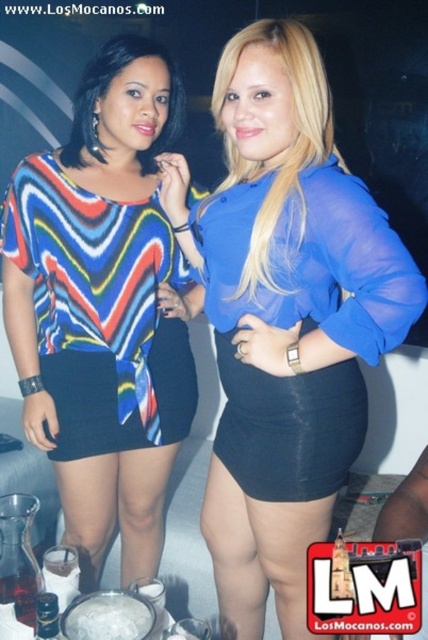
Does blue sheer blouse at center appear under multicolored printed blouse at left?

Yes.

Does blue sheer blouse at center have a lesser height compared to multicolored printed blouse at left?

No, blue sheer blouse at center is not shorter than multicolored printed blouse at left.

Does point (315, 252) come closer to viewer compared to point (146, 337)?

Yes, point (315, 252) is closer to viewer.

At what (x,y) coordinates should I click in order to perform the action: click on blue sheer blouse at center. Please return your answer as a coordinate pair (x, y). The height and width of the screenshot is (640, 428). Looking at the image, I should click on (285, 316).

Who is positioned more to the left, multicolored fabric dress at center or shiny metallic bottle at lower left?

shiny metallic bottle at lower left

Between multicolored fabric dress at center and shiny metallic bottle at lower left, which one is positioned lower?

shiny metallic bottle at lower left is lower down.

Measure the distance between multicolored fabric dress at center and camera.

multicolored fabric dress at center and camera are 4.77 feet apart.

This screenshot has width=428, height=640. What are the coordinates of `multicolored fabric dress at center` in the screenshot? It's located at (107, 92).

Describe the element at coordinates (103, 301) in the screenshot. I see `multicolored printed blouse at left` at that location.

Is point (151, 365) positioned before point (56, 616)?

No.

You are a GUI agent. You are given a task and a screenshot of the screen. Output one action in this format:
    pyautogui.click(x=<x>, y=<y>)
    Task: Click on the multicolored printed blouse at left
    This screenshot has width=428, height=640.
    Given the screenshot: What is the action you would take?
    pyautogui.click(x=103, y=301)

This screenshot has height=640, width=428. I want to click on multicolored printed blouse at left, so click(x=103, y=301).